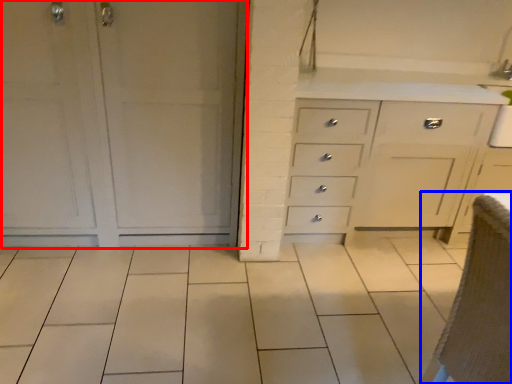
Question: Which of the following is the closest to the observer, door (highlighted by a red box) or armchair (highlighted by a blue box)?

Choices:
 (A) door
 (B) armchair

Answer: (B)